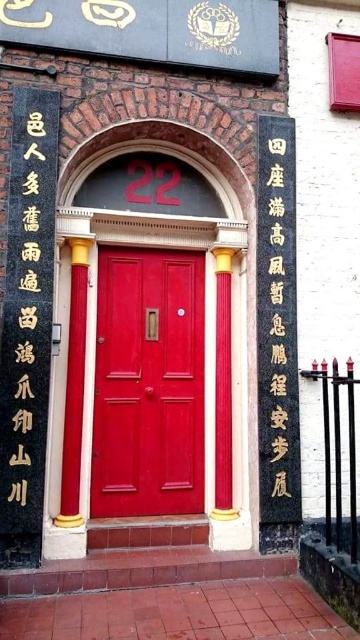
Question: Which object is the farthest from the matte wood door at center?

Choices:
 (A) black stone writing at left
 (B) black stone writing at center

Answer: (B)

Question: Which of the following is the closest to the observer?

Choices:
 (A) (25, 180)
 (B) (290, 204)
 (C) (124, 400)

Answer: (A)

Question: Is matte wood door at center wider than black stone writing at center?

Choices:
 (A) yes
 (B) no

Answer: (A)

Question: Can you confirm if black stone writing at left is positioned below black stone writing at center?

Choices:
 (A) no
 (B) yes

Answer: (B)

Question: Considering the real-world distances, which object is closest to the black stone writing at left?

Choices:
 (A) matte wood door at center
 (B) black stone writing at center

Answer: (A)

Question: Is black stone writing at left further to the viewer compared to black stone writing at center?

Choices:
 (A) no
 (B) yes

Answer: (A)